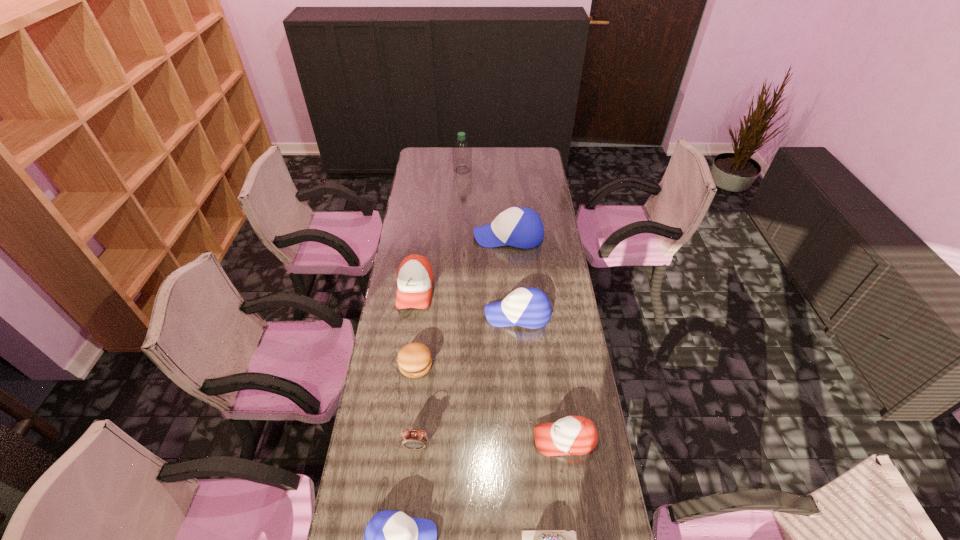
You are a GUI agent. You are given a task and a screenshot of the screen. Output one action in this format:
    pyautogui.click(x=<x>, y=<y>)
    Task: Click on the baseball cap identified as the fourth closest to the alarm clock
    Image resolution: width=960 pixels, height=540 pixels.
    Given the screenshot: What is the action you would take?
    pyautogui.click(x=415, y=278)

In order to click on baseball cap identified as the closest to the farther orange baseball cap in this screenshot , I will do `click(520, 227)`.

Locate an element on the screen. This screenshot has height=540, width=960. the second closest white baseball cap to the second biggest white baseball cap is located at coordinates (392, 539).

In order to click on white baseball cap identified as the closest to the nearest baseball cap in this screenshot , I will do `click(527, 307)`.

Identify the location of blank space that satisfies the following two spatial constraints: 1. on the front-facing side of the nearer orange baseball cap; 2. on the face of the alarm clock. (565, 446).

Image resolution: width=960 pixels, height=540 pixels. I want to click on vacant area that satisfies the following two spatial constraints: 1. on the front-facing side of the second nearest white baseball cap; 2. on the face of the alarm clock, so click(527, 446).

What are the coordinates of `free region that satisfies the following two spatial constraints: 1. on the front-facing side of the farthest white baseball cap; 2. on the front-facing side of the left orange baseball cap` in the screenshot? It's located at (512, 290).